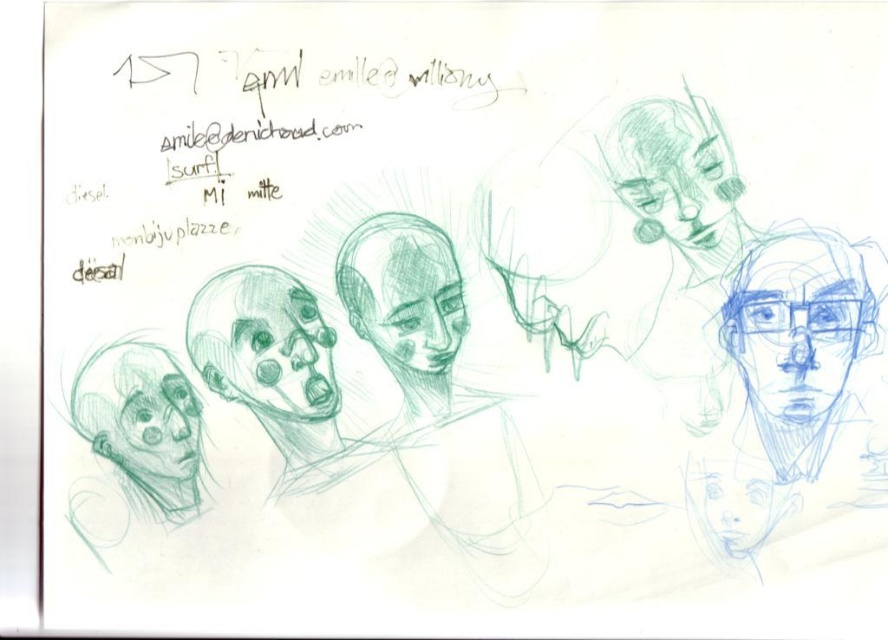
Between blue pencil sketch at upper right and gray pencil sketch of skull at center, which one has less height?

gray pencil sketch of skull at center is shorter.

Does blue pencil sketch at upper right come behind gray pencil sketch of skull at center?

No, blue pencil sketch at upper right is in front of gray pencil sketch of skull at center.

Which is behind, point (815, 349) or point (219, 358)?

Point (219, 358)

This screenshot has width=888, height=640. Find the location of `blue pencil sketch at upper right`. blue pencil sketch at upper right is located at coordinates [x=797, y=324].

Between point (275, 349) and point (728, 173), which one is positioned in front?

Point (728, 173)

Identify the location of gray pencil sketch of skull at center. This screenshot has width=888, height=640. (263, 342).

Image resolution: width=888 pixels, height=640 pixels. I want to click on gray pencil sketch of skull at center, so click(x=263, y=342).

Is the position of gray pencil sketch of skull at center more distant than that of graphite sketch face at lower left?

Yes, it is.

Which is more to the left, gray pencil sketch of skull at center or graphite sketch face at lower left?

graphite sketch face at lower left is more to the left.

Is point (331, 385) positioned in front of point (189, 396)?

No, (331, 385) is behind (189, 396).

You are a GUI agent. You are given a task and a screenshot of the screen. Output one action in this format:
    pyautogui.click(x=<x>, y=<y>)
    Task: Click on the gray pencil sketch of skull at center
    The image size is (888, 640).
    Given the screenshot: What is the action you would take?
    pyautogui.click(x=263, y=342)